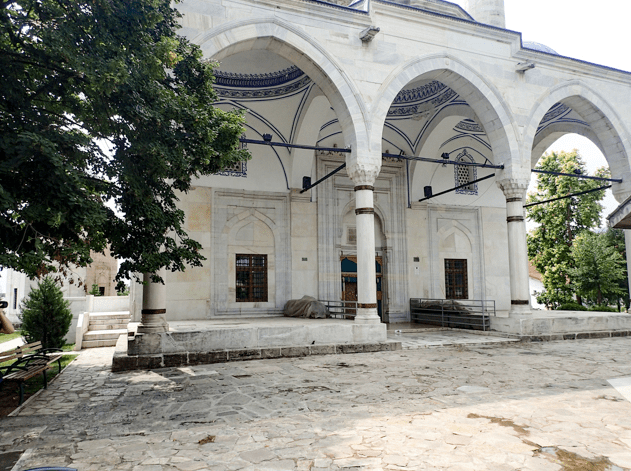
Where is `archway`? archway is located at coordinates (338, 105), (491, 123), (615, 135).